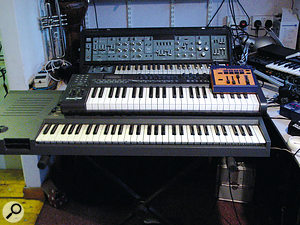
Find the location of a particular element. wall is located at coordinates (116, 10).